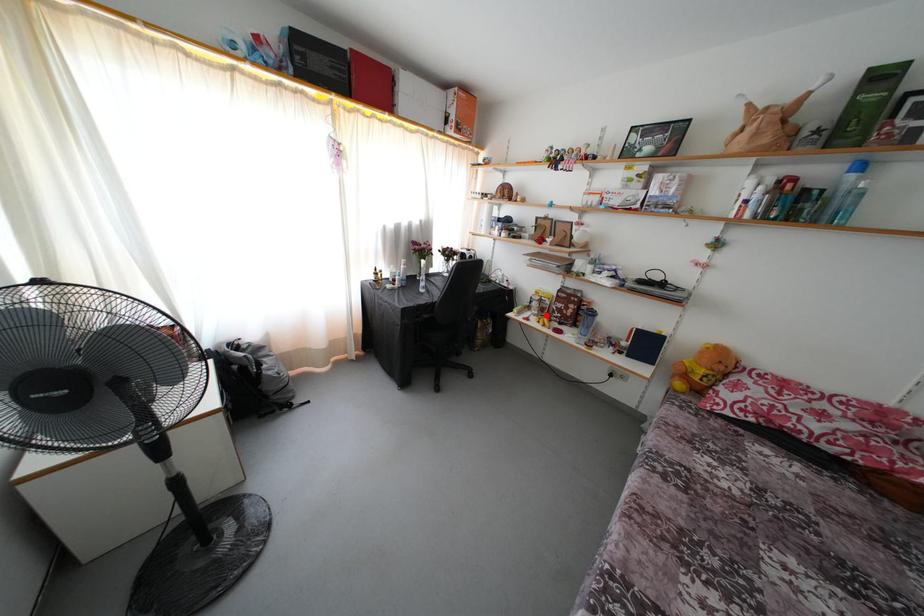
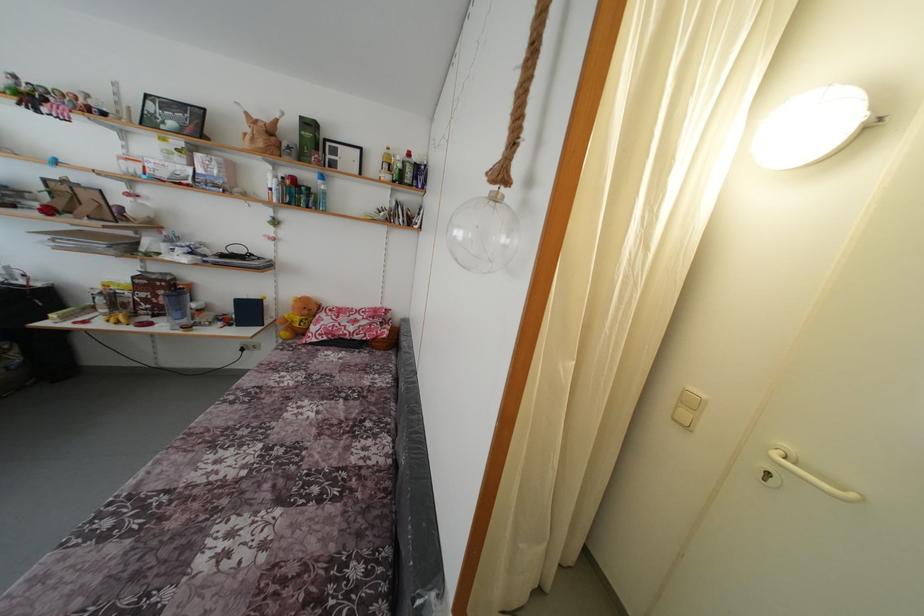
In the second image, find the point that corresponds to the highlighted location in the first image.

(120, 310)